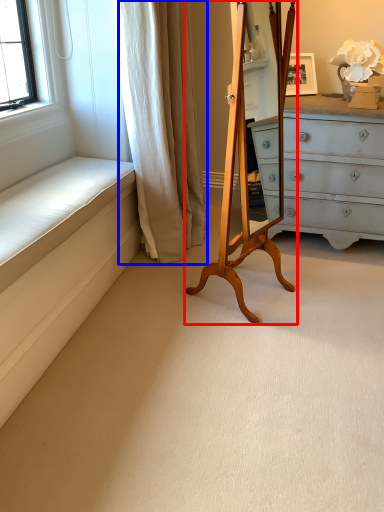
Question: Which of the following is the farthest to the observer, easel (highlighted by a red box) or curtain (highlighted by a blue box)?

Choices:
 (A) easel
 (B) curtain

Answer: (B)